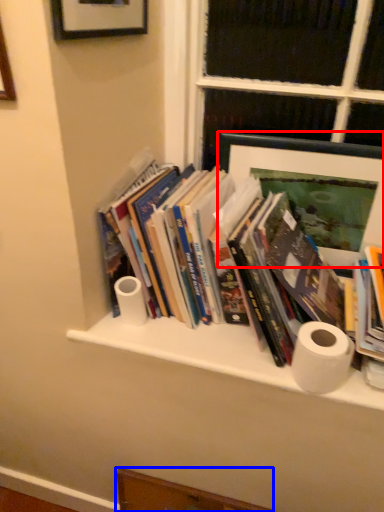
Question: Which point is closer to the camera, picture frame (highlighted by a red box) or drawer (highlighted by a blue box)?

Choices:
 (A) picture frame
 (B) drawer

Answer: (A)